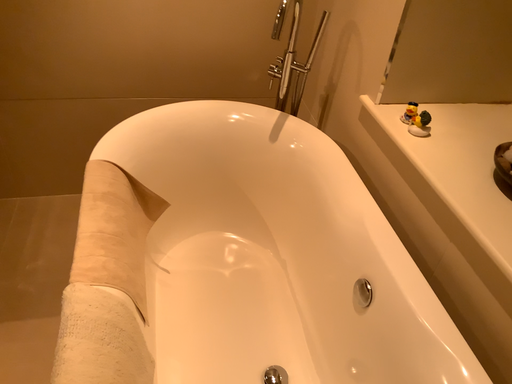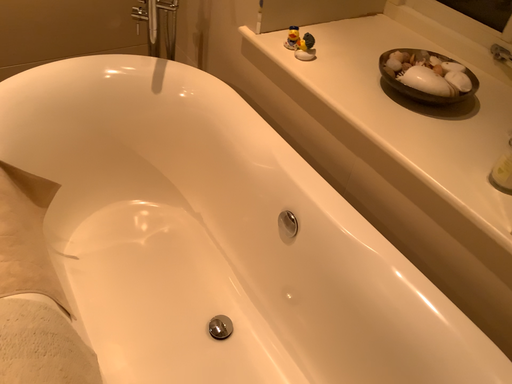
Question: Which way did the camera rotate in the video?

Choices:
 (A) rotated left
 (B) rotated right

Answer: (B)